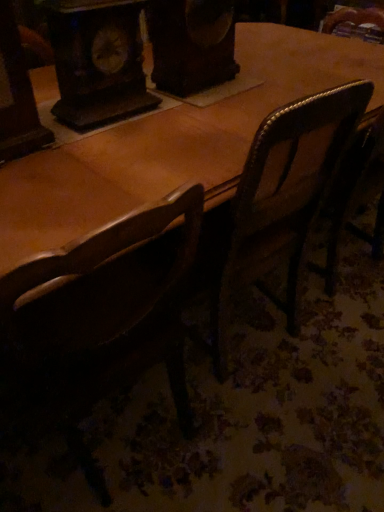
Question: Can you confirm if wooden clock at upper left is positioned to the left of brown wooden chair at left?

Choices:
 (A) no
 (B) yes

Answer: (B)

Question: Is wooden clock at upper left touching brown wooden chair at left?

Choices:
 (A) no
 (B) yes

Answer: (A)

Question: Can you confirm if wooden clock at upper left is wider than brown wooden chair at left?

Choices:
 (A) yes
 (B) no

Answer: (B)

Question: Is wooden clock at upper left smaller than brown wooden chair at left?

Choices:
 (A) no
 (B) yes

Answer: (B)

Question: Could you tell me if wooden clock at upper left is facing brown wooden chair at left?

Choices:
 (A) yes
 (B) no

Answer: (B)

Question: Is brown wooden chair at left at the back of wooden clock at upper left?

Choices:
 (A) yes
 (B) no

Answer: (B)

Question: Is brown wooden chair at left positioned far away from wooden clock at upper left?

Choices:
 (A) yes
 (B) no

Answer: (B)

Question: Considering the relative sizes of brown wooden chair at left and wooden clock at upper left in the image provided, is brown wooden chair at left smaller than wooden clock at upper left?

Choices:
 (A) yes
 (B) no

Answer: (B)

Question: Can you confirm if brown wooden chair at left is taller than wooden clock at upper left?

Choices:
 (A) yes
 (B) no

Answer: (A)

Question: Considering the relative sizes of brown wooden chair at left and wooden clock at upper left in the image provided, is brown wooden chair at left thinner than wooden clock at upper left?

Choices:
 (A) no
 (B) yes

Answer: (A)

Question: Is brown wooden chair at left at the right side of wooden clock at upper left?

Choices:
 (A) no
 (B) yes

Answer: (B)

Question: Is brown wooden chair at left touching wooden clock at upper left?

Choices:
 (A) yes
 (B) no

Answer: (B)

Question: Considering the positions of brown wooden chair at left and wooden clock at upper left in the image, is brown wooden chair at left bigger or smaller than wooden clock at upper left?

Choices:
 (A) big
 (B) small

Answer: (A)